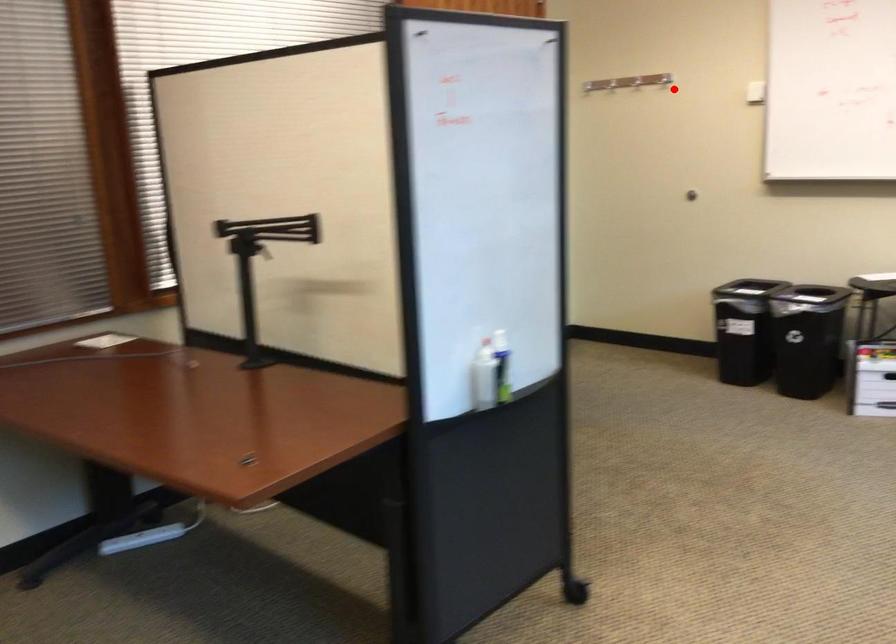
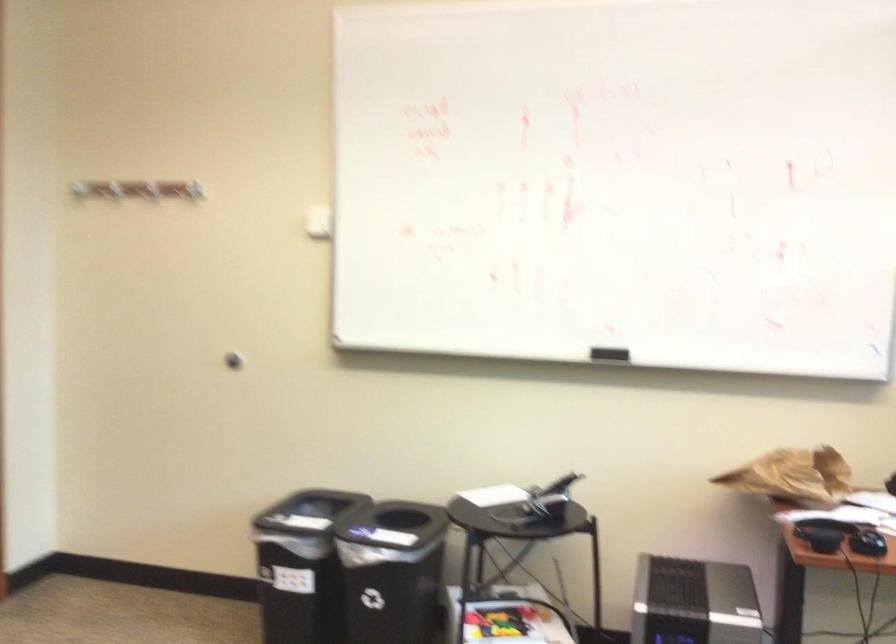
Locate, in the second image, the point that corresponds to the highlighted location in the first image.

(317, 222)